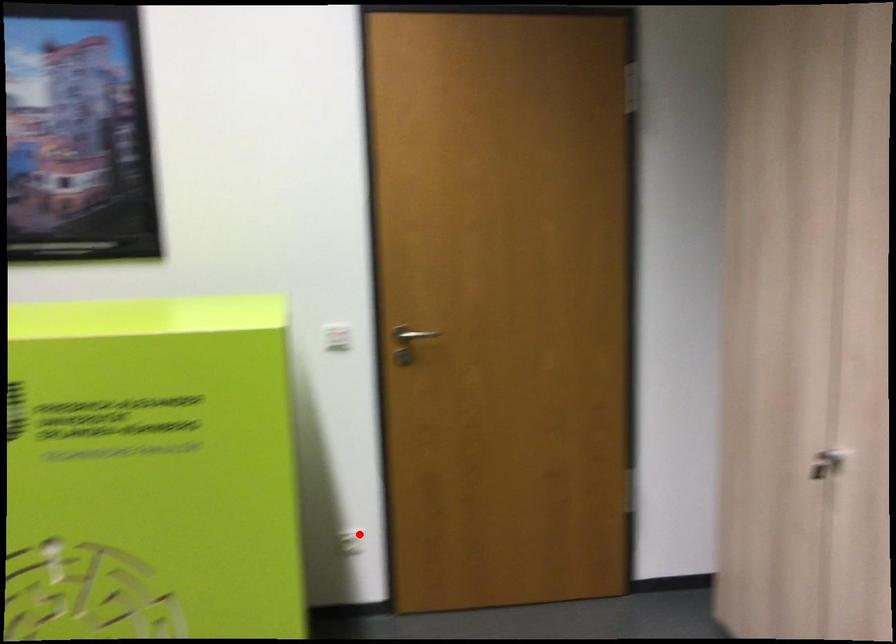
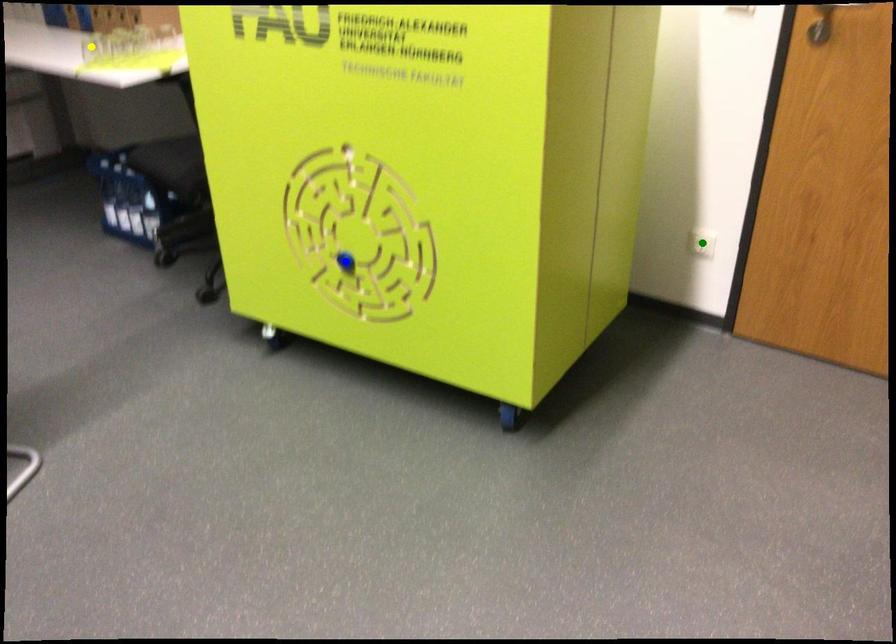
Question: I am providing you with two images of the same scene from different viewpoints. A red point is marked on the first image. You are given multiple points on the second image. Can you choose the point in image 2 that corresponds to the point in image 1?

Choices:
 (A) green point
 (B) yellow point
 (C) blue point

Answer: (A)